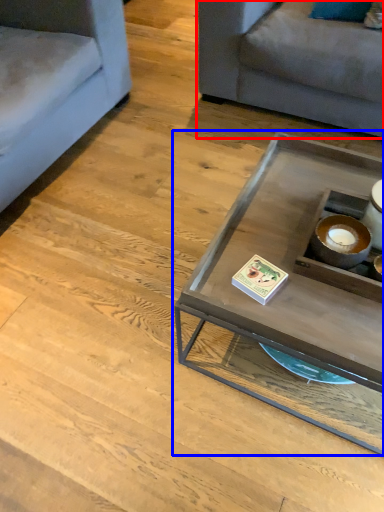
Question: Which of the following is the farthest to the observer, studio couch (highlighted by a red box) or coffee table (highlighted by a blue box)?

Choices:
 (A) studio couch
 (B) coffee table

Answer: (A)